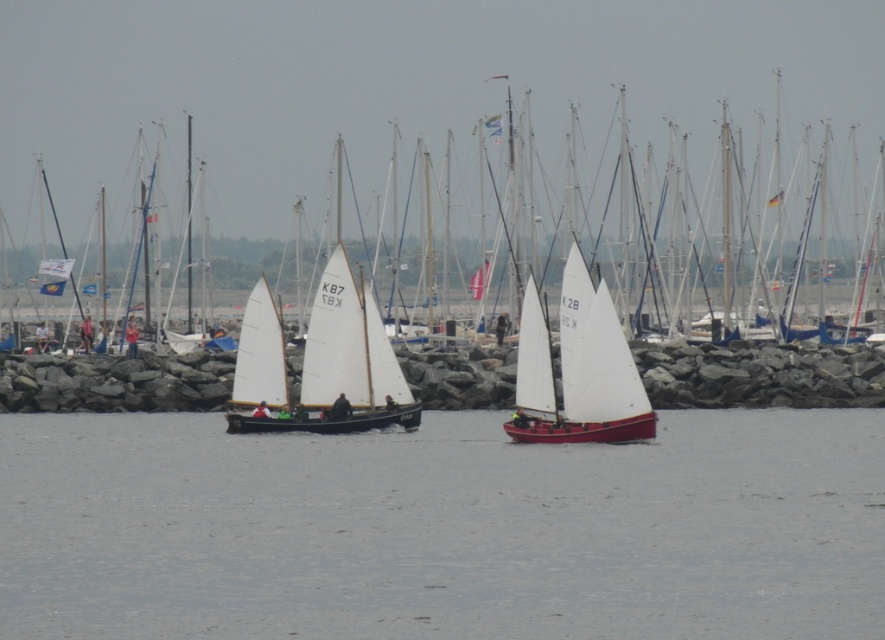
You are a sailor planning to maneuver your boat through the marina. You see the clear water at center and the white canvas sailboat at center. Which one is wider?

The clear water at center might be wider than white canvas sailboat at center according to the description.

Looking at this image, you are a sailor planning to dock your boat at the marina. You notice the clear water at center and the white canvas sailboat at center. Which object is shorter in height?

The clear water at center is not as tall as the white canvas sailboat at center, so the clear water at center is shorter in height.

You are a sailor planning to anchor your boat in the marina. You see the clear water at center and the white canvas sailboat at center. Which location would be better for anchoring, and why?

The clear water at center indicates a deeper area suitable for anchoring, as it is positioned under the white canvas sailboat at center, suggesting that boats can safely dock there without touching the bottom.